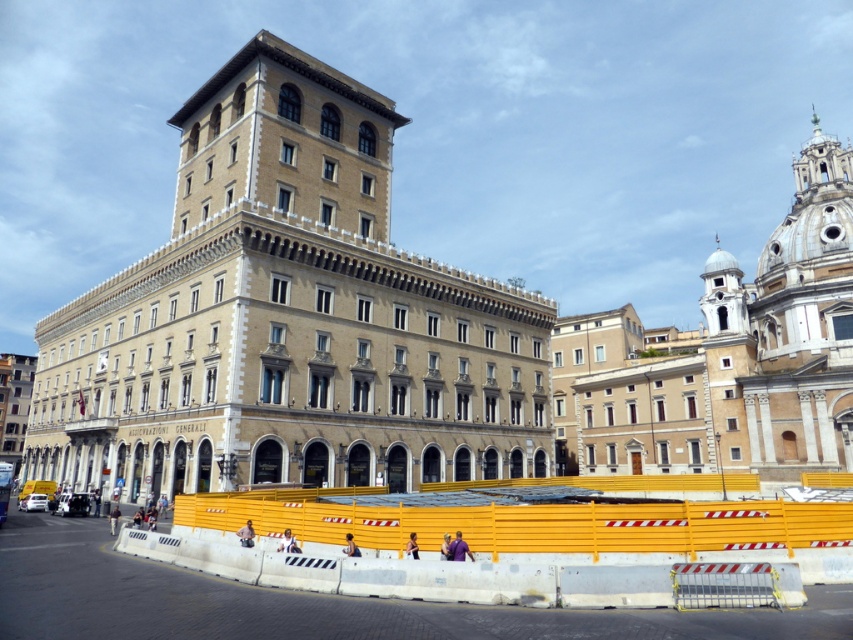
Question: Can you confirm if white marble building at upper right is positioned below yellow plastic barrier at lower center?

Choices:
 (A) yes
 (B) no

Answer: (B)

Question: Is beige stone building at center above white marble building at upper right?

Choices:
 (A) yes
 (B) no

Answer: (B)

Question: Which point is farther to the camera?

Choices:
 (A) white marble building at upper right
 (B) beige stone building at center
 (C) yellow plastic barrier at lower center

Answer: (A)

Question: Can you confirm if beige stone building at center is positioned below yellow plastic barrier at lower center?

Choices:
 (A) yes
 (B) no

Answer: (B)

Question: Which point is farther from the camera taking this photo?

Choices:
 (A) (762, 538)
 (B) (181, 467)

Answer: (B)

Question: Which of the following is the farthest from the observer?

Choices:
 (A) beige stone building at center
 (B) yellow plastic barrier at lower center

Answer: (A)